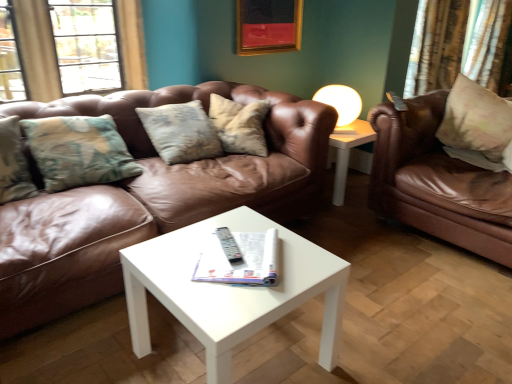
Identify the location of free space between white glossy coffee table at center and brown leather couch at right, the 1th studio couch viewed from the right. Image resolution: width=512 pixels, height=384 pixels. 385,285.